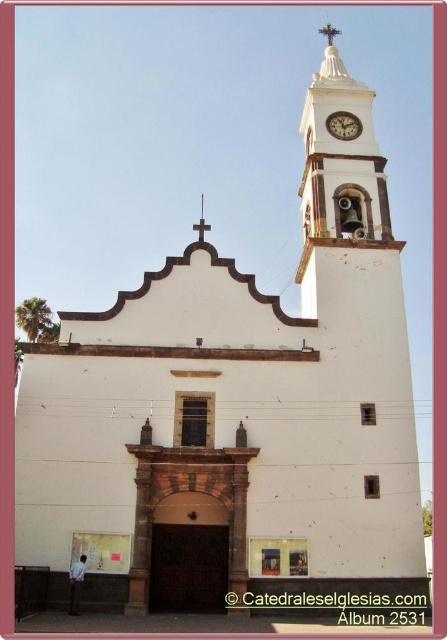
You are standing in front of the church and want to take a photo that includes both the white stucco clock tower at upper center and the metallic cross at upper center. Which object should you adjust your camera angle to focus on first to ensure both are in frame?

The white stucco clock tower at upper center is taller than the metallic cross at upper center, so you should focus on the white stucco clock tower at upper center first to ensure the entire height of both objects fits within the frame.

You are standing in front of the church and want to know which object is bigger between the white stucco clock tower at upper center and the metallic clock at upper center. Can you tell me?

The white stucco clock tower at upper center is larger in size compared to the metallic clock at upper center according to the description.

From the picture: You are standing in front of the church and want to take a photo of the white stucco clock tower at upper center. If your camera can focus on objects up to 50 meters away, will you need to move closer to take a clear photo?

The white stucco clock tower at upper center is 54.25 meters away from the viewer, which exceeds the camera focus range of 50 meters. Therefore, you need to move closer to ensure the tower is within the camera focus range.